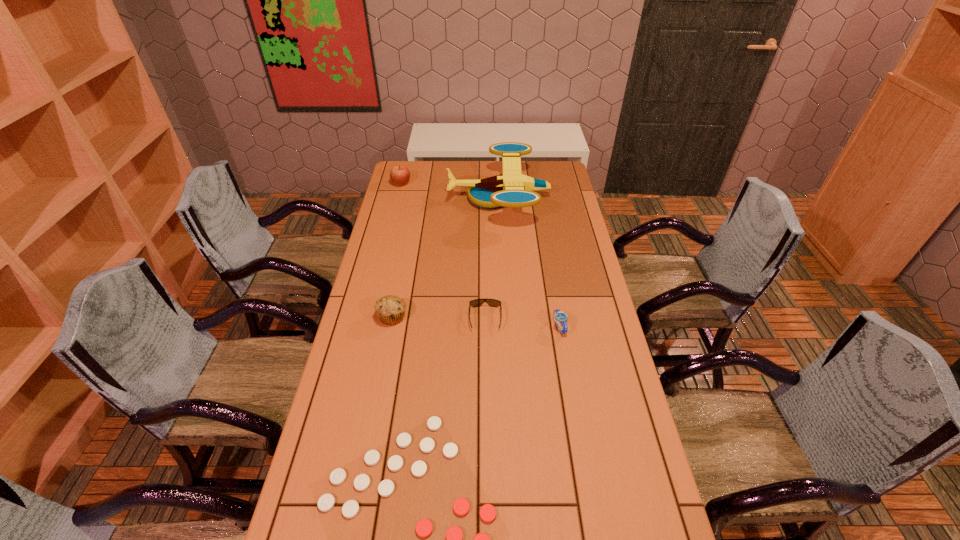
The image size is (960, 540). In order to click on free point between the apple and the third shortest object in this screenshot , I will do `click(480, 255)`.

This screenshot has height=540, width=960. I want to click on object that is the fourth closest to the third shortest object, so click(390, 309).

Locate an element on the screen. The height and width of the screenshot is (540, 960). object that ranks as the third closest to the sunglasses is located at coordinates (454, 536).

Locate an element on the screen. vacant space that satisfies the following two spatial constraints: 1. at the cockpit of the tallest object; 2. on the front-facing side of the sunglasses is located at coordinates (505, 319).

Identify the location of free location that satisfies the following two spatial constraints: 1. at the cockpit of the drone; 2. on the front-facing side of the second shortest object. Image resolution: width=960 pixels, height=540 pixels. (505, 319).

Locate an element on the screen. The image size is (960, 540). free region that satisfies the following two spatial constraints: 1. on the front-facing side of the watch; 2. on the right side of the sunglasses is located at coordinates (486, 327).